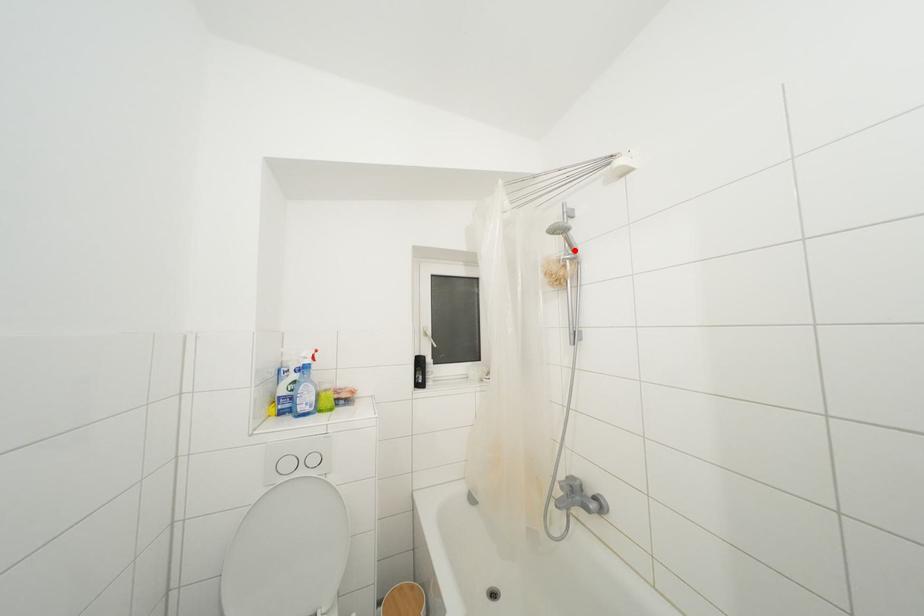
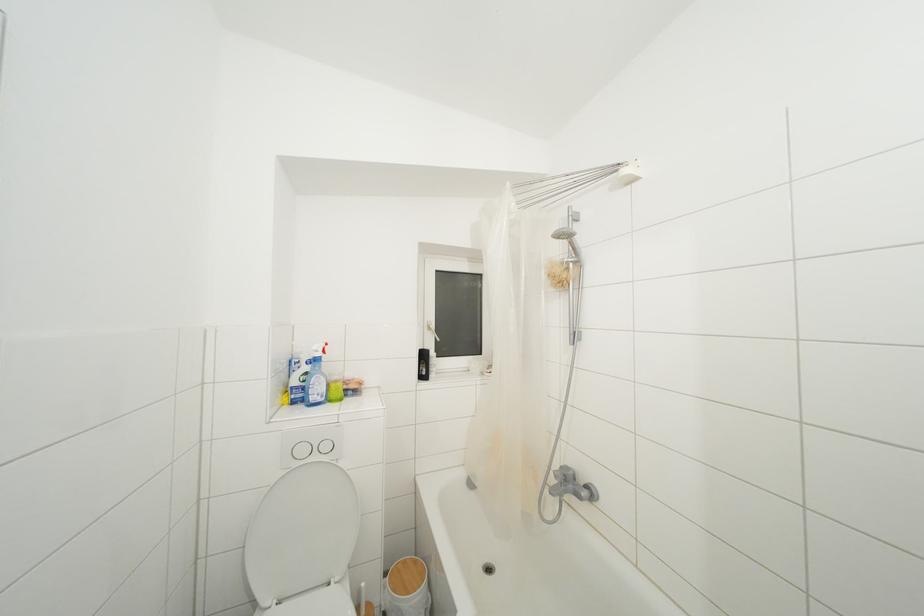
Where in the second image is the point corresponding to the highlighted location from the first image?

(578, 254)